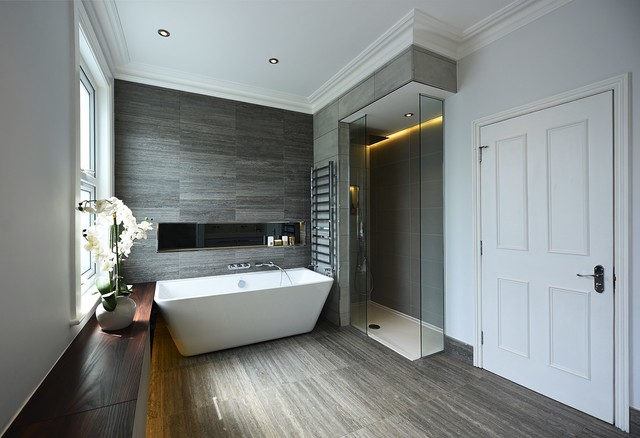
The width and height of the screenshot is (640, 438). Identify the location of window. (83, 138).